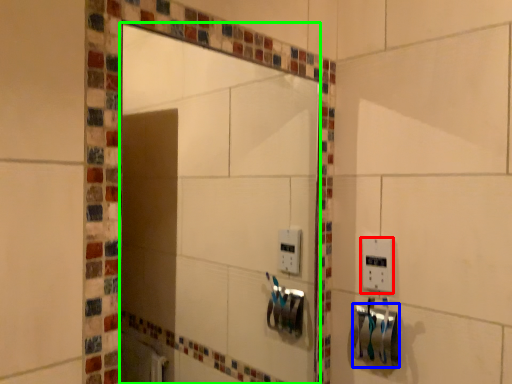
Question: Which object is positioned closest to light switch (highlighted by a red box)? Select from towel bar (highlighted by a blue box) and mirror (highlighted by a green box).

Choices:
 (A) towel bar
 (B) mirror

Answer: (A)